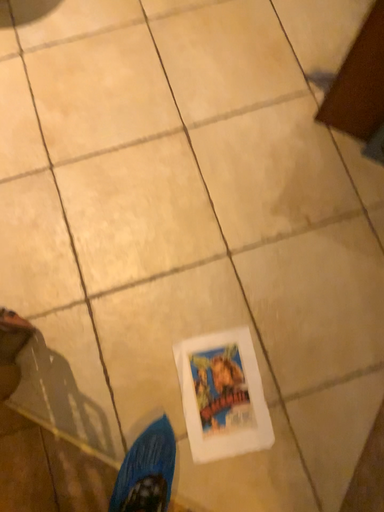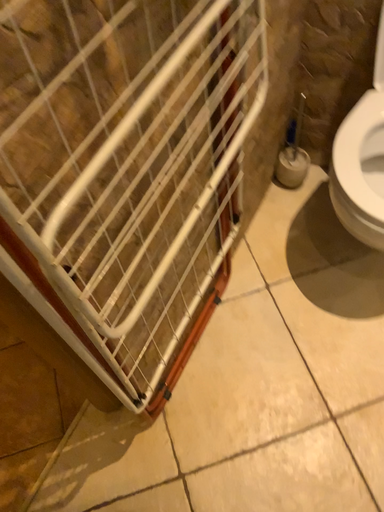
Question: Which way did the camera rotate in the video?

Choices:
 (A) rotated upward
 (B) rotated downward

Answer: (A)